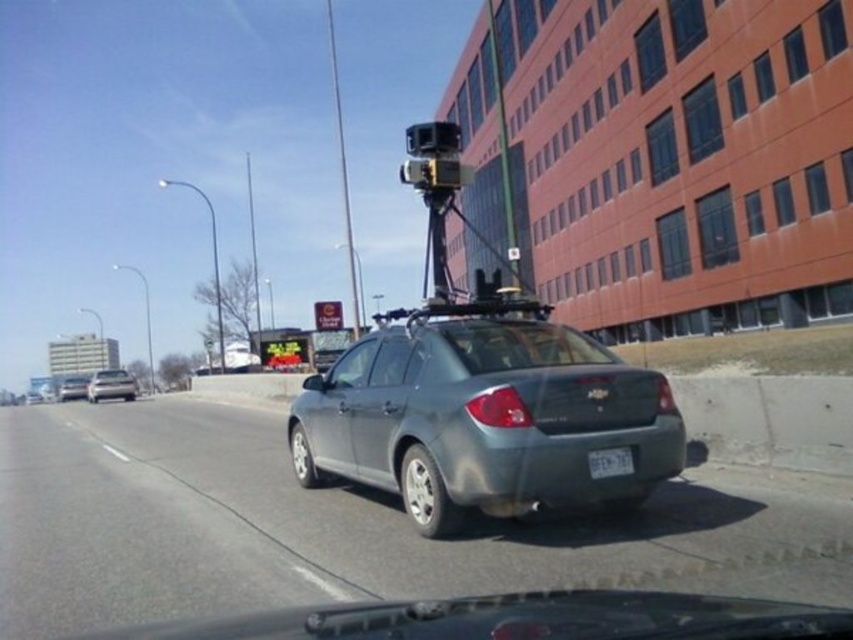
You are a driver who needs to read the license plate of the gray Chevrolet sedan. Where should you look on the car to find the white plastic license plate at center?

The white plastic license plate at center is located at the position point coordinates of (610, 461) on the car.

You are a driver in the satin silver sedan at center. You notice another satin silver sedan at left in your lane. Is the other car ahead of you or behind you?

The satin silver sedan at left is in front of the satin silver sedan at center, so the other car is ahead of you.